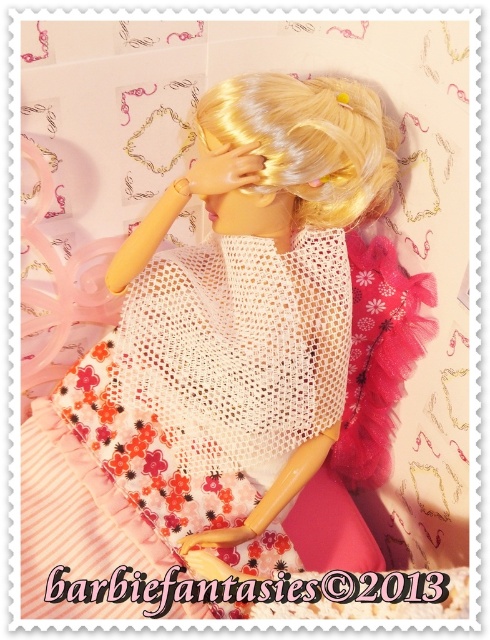
Is white mesh dress at center wider than blonde silky hair at center?

Correct, the width of white mesh dress at center exceeds that of blonde silky hair at center.

I want to click on white mesh dress at center, so click(x=186, y=404).